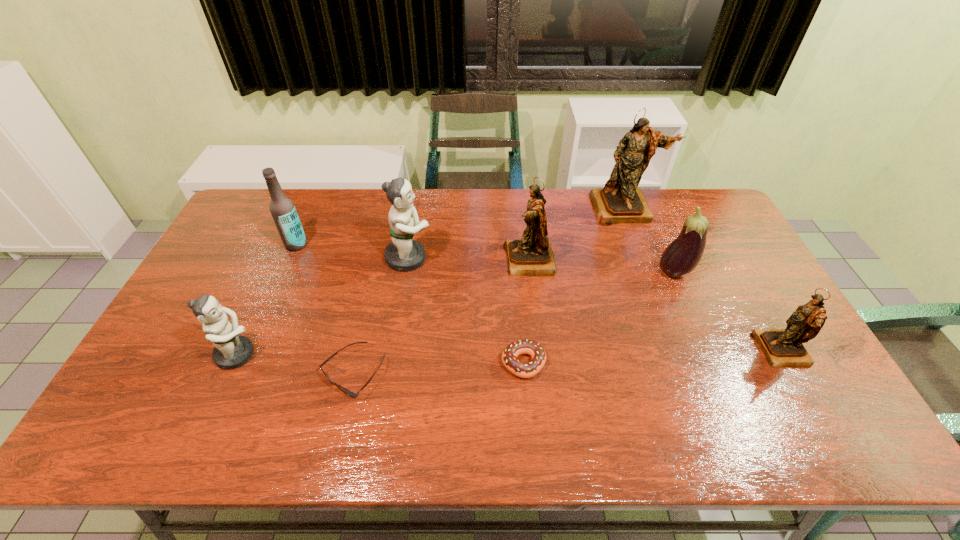
Where is `the smaller green figurine`? The image size is (960, 540). the smaller green figurine is located at coordinates (232, 350).

Locate an element on the screen. The image size is (960, 540). the nearer green figurine is located at coordinates (232, 350).

The height and width of the screenshot is (540, 960). I want to click on brown doughnut, so click(x=519, y=368).

Image resolution: width=960 pixels, height=540 pixels. Find the location of `the shortest object`. the shortest object is located at coordinates (353, 394).

At what (x,y) coordinates should I click in order to perform the action: click on sunglasses. Please return your answer as a coordinate pair (x, y). This screenshot has height=540, width=960. Looking at the image, I should click on (353, 394).

Where is `vacant space located on the front-facing side of the biggest gold figurine`? This screenshot has width=960, height=540. vacant space located on the front-facing side of the biggest gold figurine is located at coordinates (647, 273).

Where is `vacant space located on the front-facing side of the right green figurine`? The image size is (960, 540). vacant space located on the front-facing side of the right green figurine is located at coordinates (454, 258).

You are a GUI agent. You are given a task and a screenshot of the screen. Output one action in this format:
    pyautogui.click(x=<x>, y=<y>)
    Task: Click on the free spot located on the front-facing side of the second nearest gold figurine
    
    Given the screenshot: What is the action you would take?
    pyautogui.click(x=395, y=260)

I want to click on free location located 0.140m on the front-facing side of the second nearest gold figurine, so click(x=460, y=260).

Find the location of a particular element. The image size is (960, 540). free point located on the front-facing side of the second nearest gold figurine is located at coordinates (482, 260).